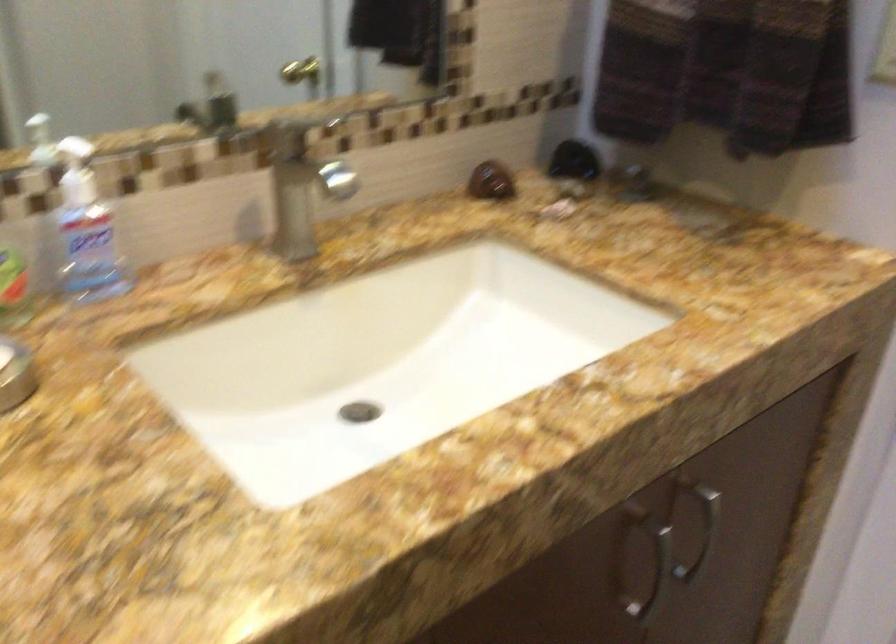
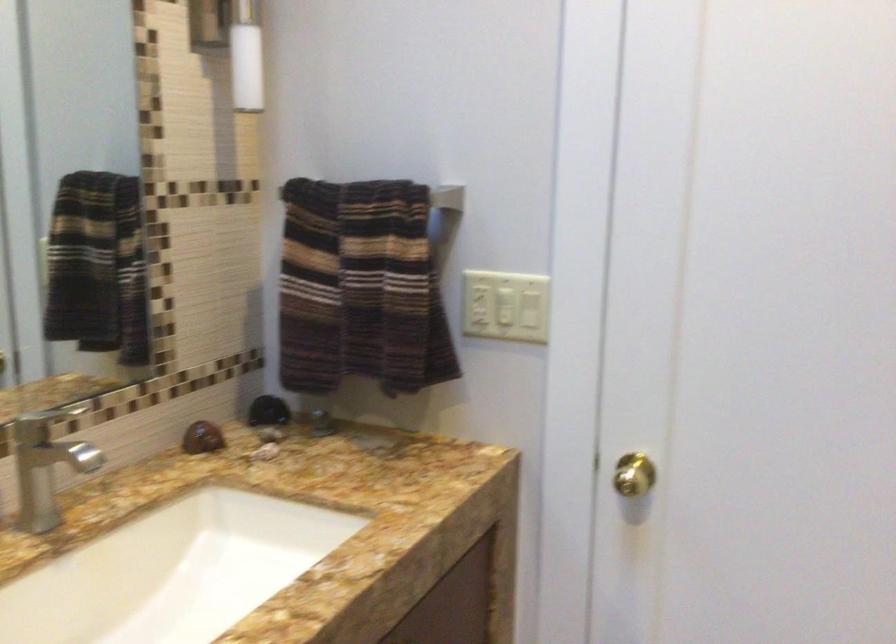
Question: The camera is either moving clockwise (left) or counter-clockwise (right) around the object. The first image is from the beginning of the video and the second image is from the end. Is the camera moving left or right when shooting the video?

Choices:
 (A) Left
 (B) Right

Answer: (A)